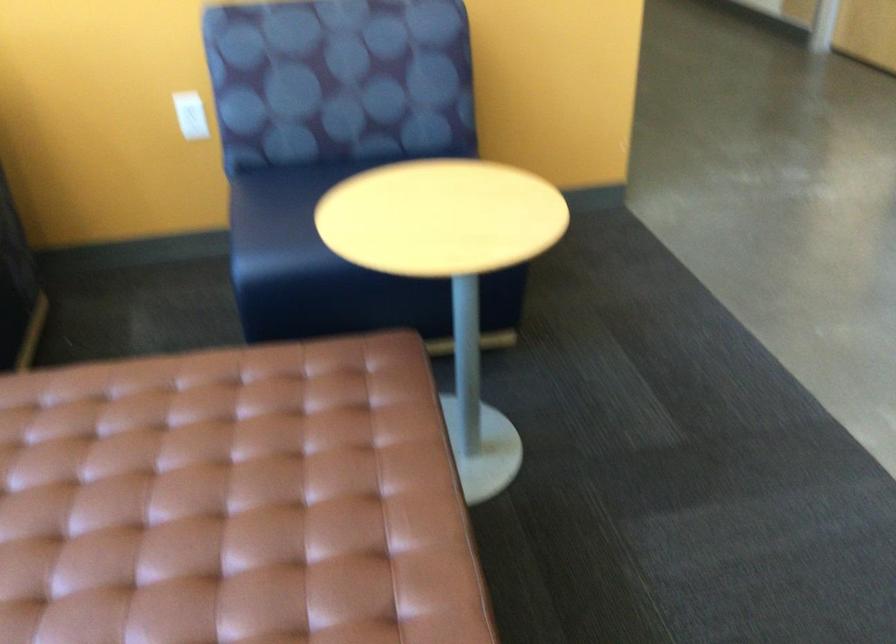
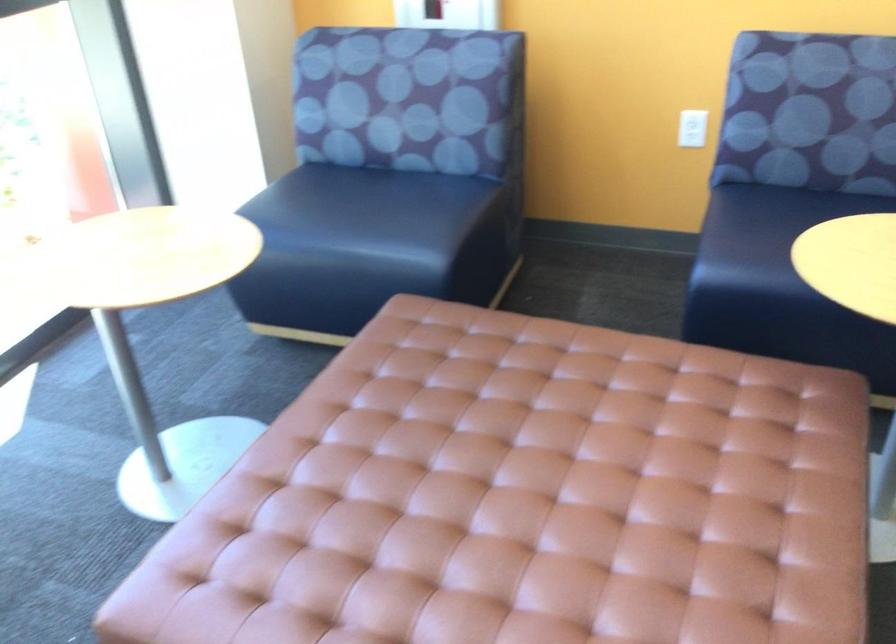
Question: The camera is either moving clockwise (left) or counter-clockwise (right) around the object. The first image is from the beginning of the video and the second image is from the end. Is the camera moving left or right when shooting the video?

Choices:
 (A) Left
 (B) Right

Answer: (B)